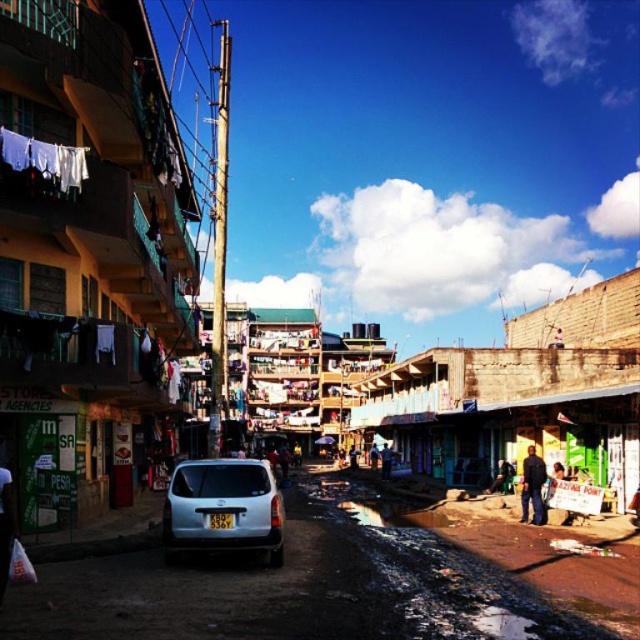
Which is above, satin silver suv at center or white fabric at lower left?

white fabric at lower left

Is satin silver suv at center taller than white fabric at lower left?

Yes.

Is point (236, 490) positioned after point (10, 538)?

Yes, it is.

You are a GUI agent. You are given a task and a screenshot of the screen. Output one action in this format:
    pyautogui.click(x=<x>, y=<y>)
    Task: Click on the satin silver suv at center
    Image resolution: width=640 pixels, height=640 pixels.
    Given the screenshot: What is the action you would take?
    pyautogui.click(x=221, y=508)

Is white matte car at center bigger than white fabric at lower left?

Correct, white matte car at center is larger in size than white fabric at lower left.

Can you confirm if white matte car at center is taller than white fabric at lower left?

No, white matte car at center is not taller than white fabric at lower left.

Locate an element on the screen. Image resolution: width=640 pixels, height=640 pixels. white matte car at center is located at coordinates (342, 582).

Can you confirm if satin silver suv at center is taller than dark blue jeans at lower right?

Yes, satin silver suv at center is taller than dark blue jeans at lower right.

Based on the photo, can you confirm if satin silver suv at center is positioned to the left of dark blue jeans at lower right?

Indeed, satin silver suv at center is positioned on the left side of dark blue jeans at lower right.

Where is `satin silver suv at center`? The height and width of the screenshot is (640, 640). satin silver suv at center is located at coordinates (221, 508).